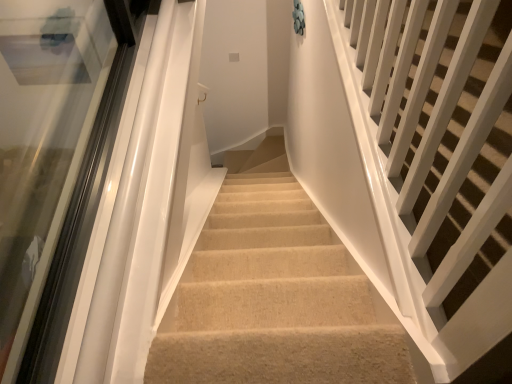
Where is `white glossy railings at upper right`? The image size is (512, 384). white glossy railings at upper right is located at coordinates (441, 129).

The image size is (512, 384). Describe the element at coordinates (441, 129) in the screenshot. I see `white glossy railings at upper right` at that location.

What do you see at coordinates (42, 143) in the screenshot?
I see `transparent glass door at left` at bounding box center [42, 143].

In order to click on transparent glass door at left in this screenshot , I will do [42, 143].

At what (x,y) coordinates should I click in order to perform the action: click on white glossy railings at upper right. Please return your answer as a coordinate pair (x, y). The image size is (512, 384). Looking at the image, I should click on (441, 129).

Considering the positions of objects transparent glass door at left and white glossy railings at upper right in the image provided, who is more to the right, transparent glass door at left or white glossy railings at upper right?

From the viewer's perspective, white glossy railings at upper right appears more on the right side.

In the scene shown: Which object is further away from the camera, transparent glass door at left or white glossy railings at upper right?

Positioned behind is transparent glass door at left.

Does point (52, 40) come in front of point (462, 240)?

No.

From the image's perspective, does transparent glass door at left appear lower than white glossy railings at upper right?

Yes.

From a real-world perspective, is transparent glass door at left on white glossy railings at upper right?

Answer: No, from a real-world perspective, transparent glass door at left is not on top of white glossy railings at upper right.

Is transparent glass door at left thinner than white glossy railings at upper right?

Indeed, transparent glass door at left has a lesser width compared to white glossy railings at upper right.

Considering the sizes of objects transparent glass door at left and white glossy railings at upper right in the image provided, who is shorter, transparent glass door at left or white glossy railings at upper right?

transparent glass door at left.

Considering the relative sizes of transparent glass door at left and white glossy railings at upper right in the image provided, is transparent glass door at left smaller than white glossy railings at upper right?

Yes.

Could white glossy railings at upper right be considered to be inside transparent glass door at left?

No, white glossy railings at upper right is not inside transparent glass door at left.

Is transparent glass door at left positioned far away from white glossy railings at upper right?

Absolutely, transparent glass door at left is distant from white glossy railings at upper right.

Is transparent glass door at left positioned with its back to white glossy railings at upper right?

transparent glass door at left does not have its back to white glossy railings at upper right.

Based on the photo, how much distance is there between transparent glass door at left and white glossy railings at upper right?

transparent glass door at left and white glossy railings at upper right are 2.03 meters apart.

Where is `stairs that appears in front of the transparent glass door at left`? This screenshot has width=512, height=384. stairs that appears in front of the transparent glass door at left is located at coordinates [x=441, y=129].

Between white glossy railings at upper right and transparent glass door at left, which one appears on the left side from the viewer's perspective?

transparent glass door at left is more to the left.

Based on the photo, is white glossy railings at upper right in front of transparent glass door at left?

Yes.

Is point (464, 238) in front of point (6, 313)?

Yes, it is in front of point (6, 313).

From the image's perspective, relative to transparent glass door at left, is white glossy railings at upper right above or below?

Clearly, from the image's perspective, white glossy railings at upper right is above transparent glass door at left.

From a real-world perspective, is white glossy railings at upper right positioned above or below transparent glass door at left?

Clearly, from a real-world perspective, white glossy railings at upper right is above transparent glass door at left.

Which of these two, white glossy railings at upper right or transparent glass door at left, is wider?

Wider between the two is white glossy railings at upper right.

Between white glossy railings at upper right and transparent glass door at left, which one has less height?

With less height is transparent glass door at left.

Who is bigger, white glossy railings at upper right or transparent glass door at left?

white glossy railings at upper right.

Is white glossy railings at upper right situated inside transparent glass door at left or outside?

white glossy railings at upper right is spatially situated outside transparent glass door at left.

Is white glossy railings at upper right in contact with transparent glass door at left?

No, white glossy railings at upper right is not with transparent glass door at left.

Is white glossy railings at upper right oriented towards transparent glass door at left?

No, white glossy railings at upper right is not turned towards transparent glass door at left.

What are the coordinates of `glass door located underneath the white glossy railings at upper right (from a real-world perspective)` in the screenshot? It's located at (42, 143).

The height and width of the screenshot is (384, 512). In order to click on stairs located above the transparent glass door at left (from a real-world perspective) in this screenshot , I will do `click(441, 129)`.

Find the location of a particular element. This screenshot has height=384, width=512. glass door below the white glossy railings at upper right (from the image's perspective) is located at coordinates (42, 143).